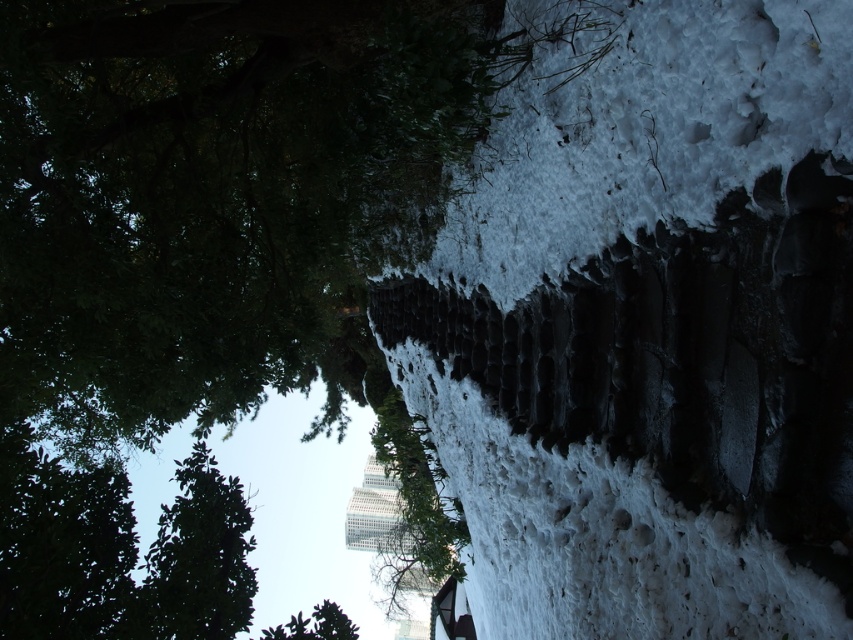
You are planning to build a snowman using the white fluffy snow at center and the green leafy tree at upper left. Which object would be more suitable for the base of the snowman?

The white fluffy snow at center is smaller than the green leafy tree at upper left, so the green leafy tree at upper left would be more suitable for the base of the snowman since it provides a larger and sturdier foundation.

You are an outdoor photographer planning to capture the contrast between the white fluffy snow at center and the green leafy tree at upper left. Based on their positions, which object is higher in the image?

The white fluffy snow at center is above the green leafy tree at upper left, so it is higher in the image.